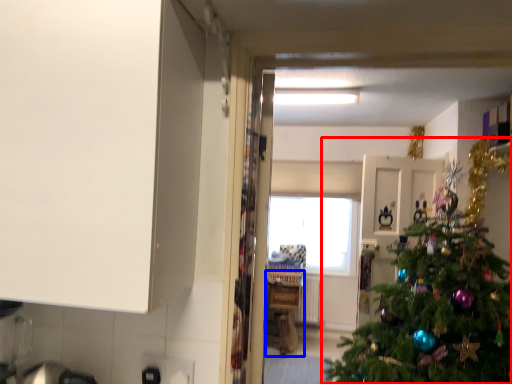
Question: Which of the following is the farthest to the observer, christmas tree (highlighted by a red box) or counter (highlighted by a blue box)?

Choices:
 (A) christmas tree
 (B) counter

Answer: (B)